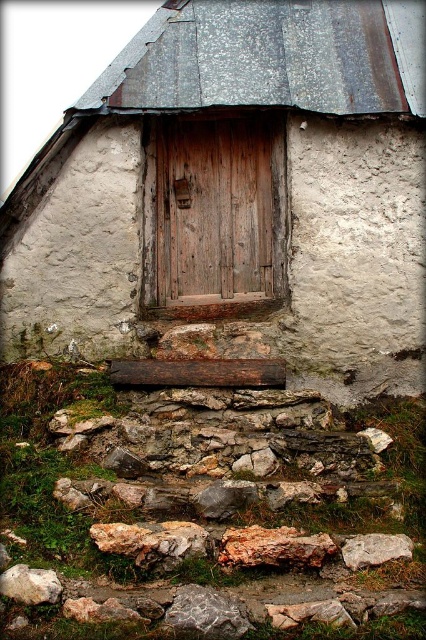
Question: Which object is positioned farthest from the rocky gray stone at lower center?

Choices:
 (A) speckled gray rock at lower left
 (B) weathered wood door at center

Answer: (B)

Question: Does wooden door at center appear over speckled gray rock at lower left?

Choices:
 (A) no
 (B) yes

Answer: (B)

Question: Does weathered wood door at center have a greater width compared to gray rough rock at lower right?

Choices:
 (A) yes
 (B) no

Answer: (A)

Question: Which is farther from the speckled gray rock at lower left?

Choices:
 (A) wooden door at center
 (B) gray rough stone at lower center
 (C) gray rough rock at lower right
 (D) rocky gray stone at lower center

Answer: (A)

Question: Which object is positioned closest to the gray rough rock at lower right?

Choices:
 (A) wooden door at center
 (B) weathered wood door at center

Answer: (A)

Question: Can you confirm if rocky gray stone at lower center is bigger than speckled gray rock at lower left?

Choices:
 (A) no
 (B) yes

Answer: (B)